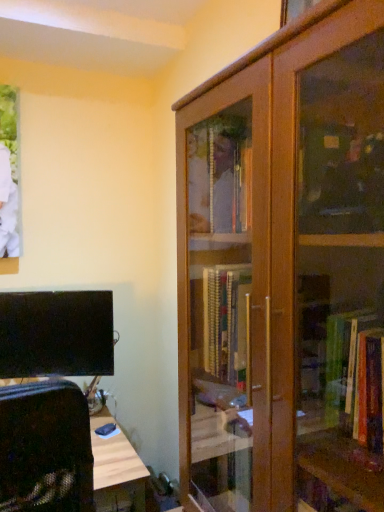
What do you see at coordinates (285, 271) in the screenshot? The height and width of the screenshot is (512, 384). I see `wooden bookcase at right` at bounding box center [285, 271].

Where is `wooden bookcase at right`? Image resolution: width=384 pixels, height=512 pixels. wooden bookcase at right is located at coordinates (285, 271).

I want to click on wooden bookcase at right, so click(285, 271).